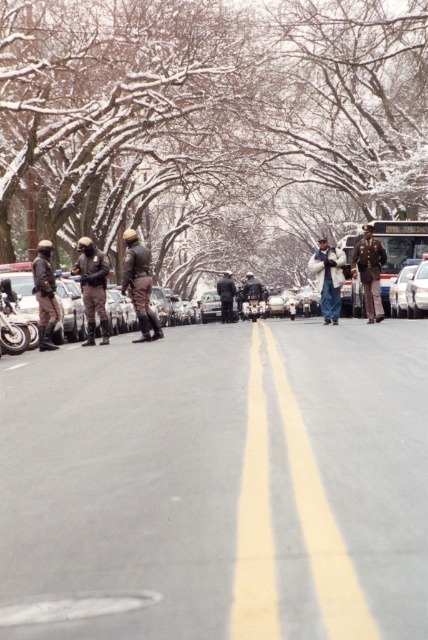
Question: Which object is closer to the camera taking this photo?

Choices:
 (A) shiny gold uniform at center
 (B) white glossy car at center
 (C) yellow asphalt road at center

Answer: (C)

Question: Which point appears closest to the camera in this image?

Choices:
 (A) (353, 312)
 (B) (226, 284)

Answer: (A)

Question: Considering the relative positions of shiny gold uniform at center and dark blue uniform at center in the image provided, where is shiny gold uniform at center located with respect to dark blue uniform at center?

Choices:
 (A) left
 (B) right

Answer: (B)

Question: Does white glossy sedan at center-right have a greater width compared to dark blue uniform at center?

Choices:
 (A) yes
 (B) no

Answer: (A)

Question: Does yellow asphalt road at center come behind white fuzzy coat at center?

Choices:
 (A) yes
 (B) no

Answer: (B)

Question: Which is farther from the matte black helmet at left?

Choices:
 (A) white glossy sedan at center-right
 (B) white glossy car at center

Answer: (A)